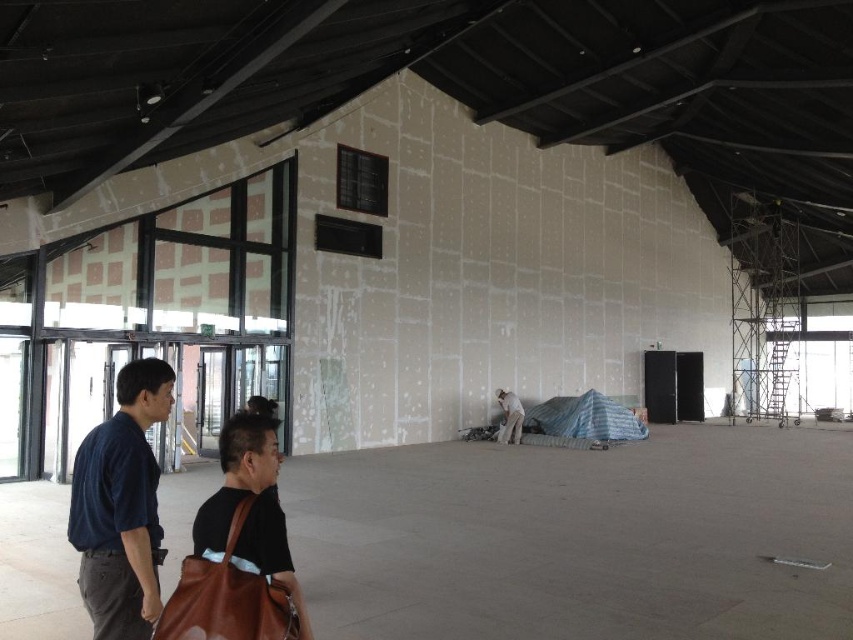
You are a delivery person who needs to hand over a package to the construction worker in the scene. The package is too large to carry, so you have to place it near the brown leather bag at lower center and the white matte man at center. Where should you place the package so that it is closest to both objects?

The brown leather bag at lower center is in front of the white matte man at center, so placing the package between them would be closest to both objects.

You are an inspector checking the construction site. You notice the dark blue shirt at left and the brown leather bag at lower center. Which object is wider?

The dark blue shirt at left is wider than the brown leather bag at lower center according to the description.

You are a construction supervisor standing at the entrance of the construction site. You see the dark blue shirt at left and the white matte man at center. Which one is closer to you?

The dark blue shirt at left is closer to you because it is only 15.58 meters away from the white matte man at center, but since you are at the entrance, the distance might vary depending on your position.